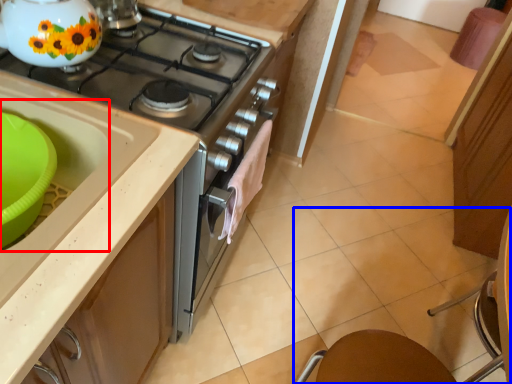
Question: Which object is further to the camera taking this photo, sink (highlighted by a red box) or chair (highlighted by a blue box)?

Choices:
 (A) sink
 (B) chair

Answer: (A)